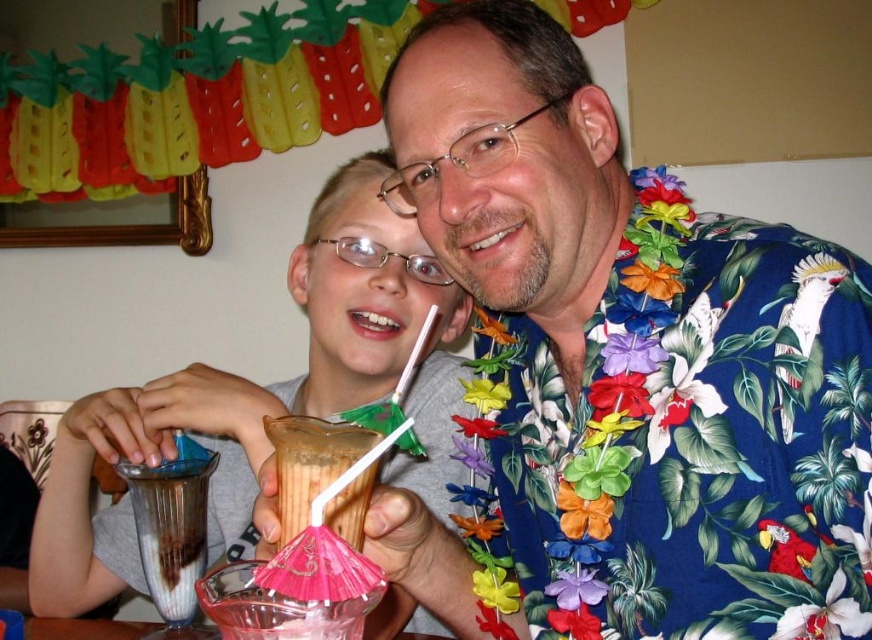
Does point (322, 387) come farther from viewer compared to point (355, 436)?

Yes, it is.

Can you confirm if smooth plastic cup at center is thinner than translucent plastic cup at center?

Incorrect, smooth plastic cup at center's width is not less than translucent plastic cup at center's.

Between point (182, 381) and point (349, 541), which one is positioned in front?

Point (349, 541) is in front.

The width and height of the screenshot is (872, 640). What are the coordinates of `smooth plastic cup at center` in the screenshot? It's located at (264, 397).

Describe the element at coordinates (639, 355) in the screenshot. I see `blue floral shirt at center` at that location.

In the scene shown: Which of these two, blue floral shirt at center or translucent plastic cup at center, stands shorter?

With less height is translucent plastic cup at center.

Is point (603, 637) positioned before point (366, 435)?

No.

Locate an element on the screen. Image resolution: width=872 pixels, height=640 pixels. blue floral shirt at center is located at coordinates [639, 355].

Between blue floral shirt at center and smooth plastic cup at center, which one appears on the right side from the viewer's perspective?

Positioned to the right is blue floral shirt at center.

This screenshot has width=872, height=640. What do you see at coordinates (639, 355) in the screenshot?
I see `blue floral shirt at center` at bounding box center [639, 355].

The image size is (872, 640). In order to click on blue floral shirt at center in this screenshot , I will do coord(639,355).

The image size is (872, 640). In order to click on blue floral shirt at center in this screenshot , I will do `click(639, 355)`.